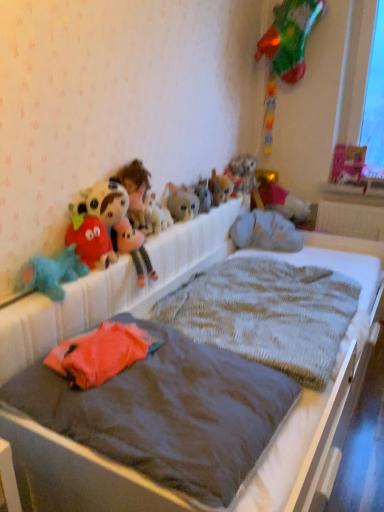
Question: Is knitted gray blanket at center, which is the second mattress from front to back, facing towards fluffy plush toy at center, acting as the 4th toy starting from the left?

Choices:
 (A) no
 (B) yes

Answer: (A)

Question: Considering the relative positions of knitted gray blanket at center, placed as the 1th mattress when sorted from back to front, and fluffy plush toy at center, the 8th toy viewed from the right, in the image provided, is knitted gray blanket at center, placed as the 1th mattress when sorted from back to front, to the left of fluffy plush toy at center, the 8th toy viewed from the right, from the viewer's perspective?

Choices:
 (A) no
 (B) yes

Answer: (A)

Question: Can you confirm if knitted gray blanket at center, which is the second mattress from front to back, is taller than fluffy plush toy at center, the 8th toy viewed from the right?

Choices:
 (A) yes
 (B) no

Answer: (B)

Question: Is knitted gray blanket at center, placed as the 1th mattress when sorted from back to front, directly adjacent to fluffy plush toy at center, the 8th toy viewed from the right?

Choices:
 (A) no
 (B) yes

Answer: (A)

Question: Can fluffy plush toy at center, acting as the 4th toy starting from the left, be found inside knitted gray blanket at center, placed as the 1th mattress when sorted from back to front?

Choices:
 (A) yes
 (B) no

Answer: (B)

Question: Is point (241, 185) positioned closer to the camera than point (339, 151)?

Choices:
 (A) closer
 (B) farther

Answer: (A)

Question: Would you say fluffy gray stuffed animal at upper center, arranged as the 8th toy when viewed from the left, is to the left or to the right of pink cardboard box at upper right, which is the eleventh toy in left-to-right order, in the picture?

Choices:
 (A) right
 (B) left

Answer: (B)

Question: In terms of width, does fluffy gray stuffed animal at upper center, arranged as the 8th toy when viewed from the left, look wider or thinner when compared to pink cardboard box at upper right, which is the eleventh toy in left-to-right order?

Choices:
 (A) thin
 (B) wide

Answer: (B)

Question: From a real-world perspective, is fluffy gray stuffed animal at upper center, arranged as the 8th toy when viewed from the left, physically located above or below pink cardboard box at upper right, acting as the 1th toy starting from the right?

Choices:
 (A) below
 (B) above

Answer: (A)

Question: Relative to fluffy plush toy at center, the 8th toy viewed from the right, is knitted gray blanket at center, placed as the 1th mattress when sorted from back to front, in front or behind?

Choices:
 (A) behind
 (B) front

Answer: (B)

Question: In the image, is knitted gray blanket at center, which is the second mattress from front to back, on the left side or the right side of fluffy plush toy at center, acting as the 4th toy starting from the left?

Choices:
 (A) left
 (B) right

Answer: (B)

Question: In terms of size, does knitted gray blanket at center, which is the second mattress from front to back, appear bigger or smaller than fluffy plush toy at center, the 8th toy viewed from the right?

Choices:
 (A) big
 (B) small

Answer: (A)

Question: From their relative heights in the image, would you say knitted gray blanket at center, placed as the 1th mattress when sorted from back to front, is taller or shorter than fluffy plush toy at center, the 8th toy viewed from the right?

Choices:
 (A) short
 (B) tall

Answer: (A)

Question: From a real-world perspective, is red plush strawberry at upper left, which ranks as the 10th toy in right-to-left order, positioned above or below soft plush elephant at center, acting as the 9th toy starting from the left?

Choices:
 (A) above
 (B) below

Answer: (A)

Question: In terms of height, does red plush strawberry at upper left, which is counted as the 2th toy, starting from the left, look taller or shorter compared to soft plush elephant at center, acting as the 9th toy starting from the left?

Choices:
 (A) tall
 (B) short

Answer: (A)